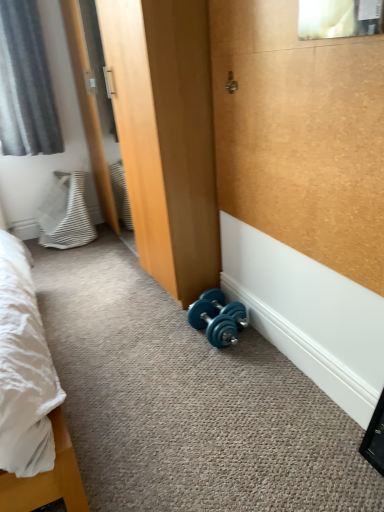
Question: From the image's perspective, is gray fabric curtain at upper left positioned above or below clear glass mirror at upper center?

Choices:
 (A) below
 (B) above

Answer: (B)

Question: Would you say gray fabric curtain at upper left is inside or outside clear glass mirror at upper center?

Choices:
 (A) inside
 (B) outside

Answer: (B)

Question: Considering the real-world distances, which object is closest to the teal rubber dumbbell at lower center?

Choices:
 (A) clear glass mirror at upper center
 (B) white striped fabric pillow at left
 (C) gray fabric curtain at upper left

Answer: (A)

Question: Based on their relative distances, which object is farther from the white striped fabric pillow at left?

Choices:
 (A) gray fabric curtain at upper left
 (B) clear glass mirror at upper center
 (C) teal rubber dumbbell at lower center

Answer: (B)